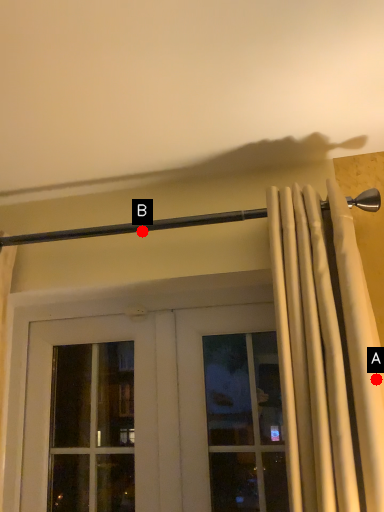
Question: Two points are circled on the image, labeled by A and B beside each circle. Which point is further to the camera?

Choices:
 (A) A is further
 (B) B is further

Answer: (B)